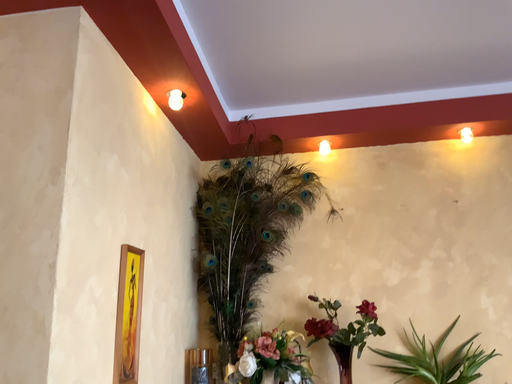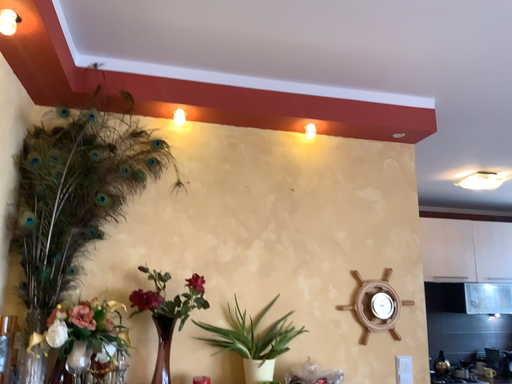
Question: How did the camera likely rotate when shooting the video?

Choices:
 (A) rotated left
 (B) rotated right

Answer: (B)